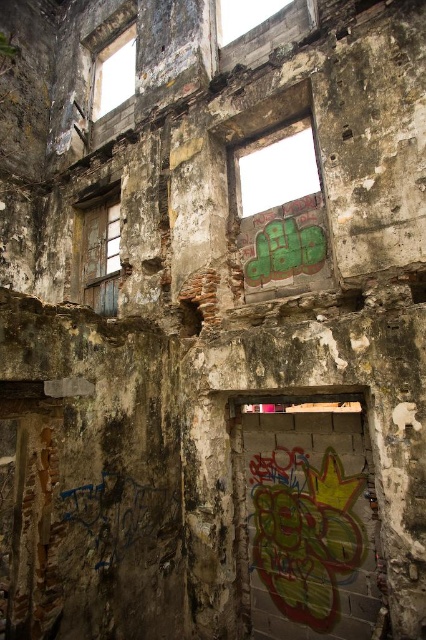
You are a painter standing in front of the wooden window at left and the transparent glass window at upper left. You want to touch the nearest window to check its condition. Which window should you choose?

The wooden window at left is closer to the viewer than the transparent glass window at upper left, so you should choose the wooden window at left to touch first.

Looking at this image, you are a painter wanting to assess the lighting in this abandoned building. You notice the wooden window at left and the transparent glass window at upper left. Which window allows more natural light into the room?

The transparent glass window at upper left allows more natural light into the room than the wooden window at left because transparent materials let light pass through, while wooden windows block more light.